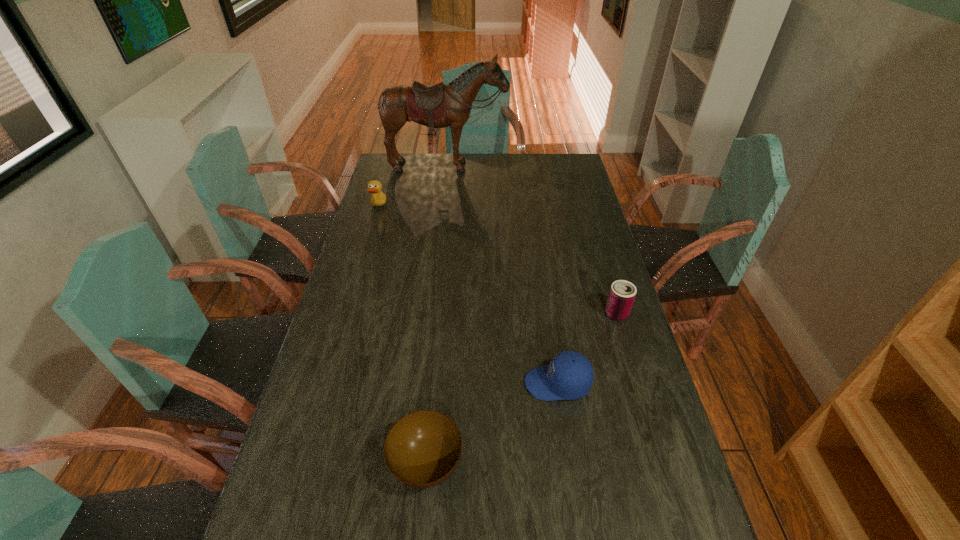
Identify the location of the farthest object. (436, 106).

Where is `the tallest object`? Image resolution: width=960 pixels, height=540 pixels. the tallest object is located at coordinates (436, 106).

Locate an element on the screen. This screenshot has width=960, height=540. duck is located at coordinates (378, 198).

Where is `the third nearest object`? the third nearest object is located at coordinates (622, 293).

Find the location of a particular element. Image resolution: width=960 pixels, height=540 pixels. the rightmost object is located at coordinates (622, 293).

Where is `cap`? The image size is (960, 540). cap is located at coordinates (569, 376).

Find the location of a particular element. The width and height of the screenshot is (960, 540). the nearest object is located at coordinates (422, 449).

The image size is (960, 540). I want to click on vacant region located on the back of the saddle, so click(x=443, y=208).

Find the location of a particular element. vacant space situated on the beak of the fourth nearest object is located at coordinates (460, 207).

You are a GUI agent. You are given a task and a screenshot of the screen. Output one action in this format:
    pyautogui.click(x=<x>, y=<y>)
    Task: Click on the free spot located on the left of the third nearest object
    The width and height of the screenshot is (960, 540).
    Given the screenshot: What is the action you would take?
    pyautogui.click(x=492, y=314)